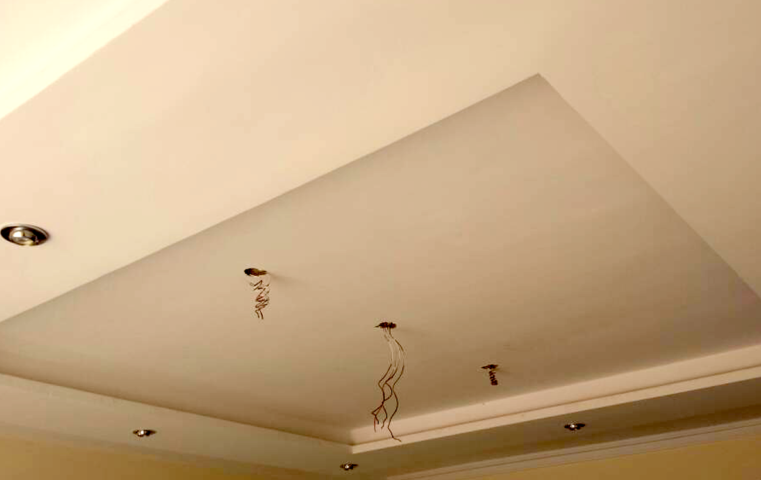
Where is `trim between inner ceiling and main ceiling`? The height and width of the screenshot is (480, 761). trim between inner ceiling and main ceiling is located at coordinates (584, 388).